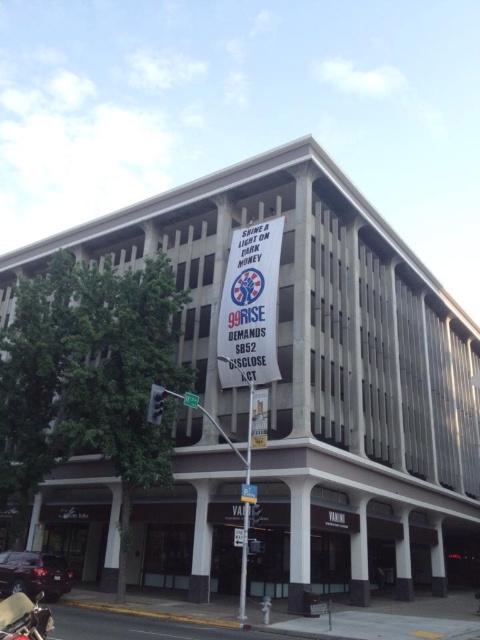
Which is more to the right, shiny chrome motorcycle at lower left or metallic pole at center?

From the viewer's perspective, metallic pole at center appears more on the right side.

How much distance is there between shiny chrome motorcycle at lower left and metallic pole at center?

shiny chrome motorcycle at lower left is 25.55 feet away from metallic pole at center.

At what (x,y) coordinates should I click in order to perform the action: click on shiny chrome motorcycle at lower left. Please return your answer as a coordinate pair (x, y). Looking at the image, I should click on (24, 618).

The image size is (480, 640). What are the coordinates of `shiny chrome motorcycle at lower left` in the screenshot? It's located at 24,618.

Who is taller, shiny chrome motorcycle at lower left or green plastic street sign at upper center?

shiny chrome motorcycle at lower left is taller.

Is shiny chrome motorcycle at lower left to the left of green plastic street sign at upper center from the viewer's perspective?

Correct, you'll find shiny chrome motorcycle at lower left to the left of green plastic street sign at upper center.

Between point (44, 637) and point (195, 400), which one is positioned behind?

The point (195, 400) is behind.

This screenshot has height=640, width=480. Find the location of `shiny chrome motorcycle at lower left`. shiny chrome motorcycle at lower left is located at coordinates (24, 618).

Can you confirm if metallic pole at center is positioned to the right of green plastic street sign at upper center?

Yes, metallic pole at center is to the right of green plastic street sign at upper center.

Is metallic pole at center smaller than green plastic street sign at upper center?

Incorrect, metallic pole at center is not smaller in size than green plastic street sign at upper center.

Which is behind, point (252, 385) or point (186, 397)?

Point (252, 385)

The height and width of the screenshot is (640, 480). Find the location of `metallic pole at center`. metallic pole at center is located at coordinates (243, 564).